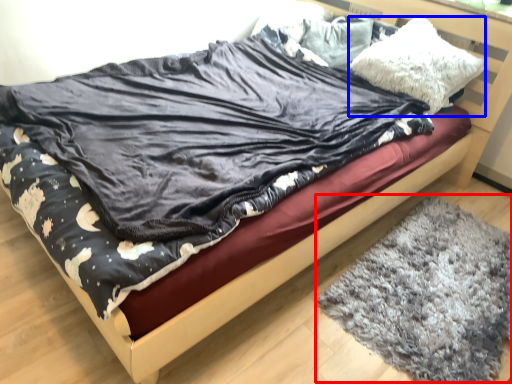
Question: Which object appears closest to the camera in this image, mat (highlighted by a red box) or pillow (highlighted by a blue box)?

Choices:
 (A) mat
 (B) pillow

Answer: (A)